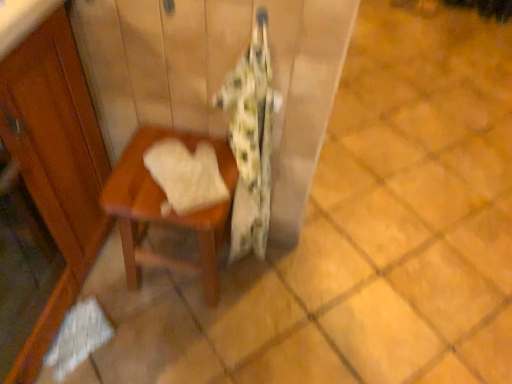
I want to click on vacant space positioned to the left of white soft towel at center, so click(x=131, y=178).